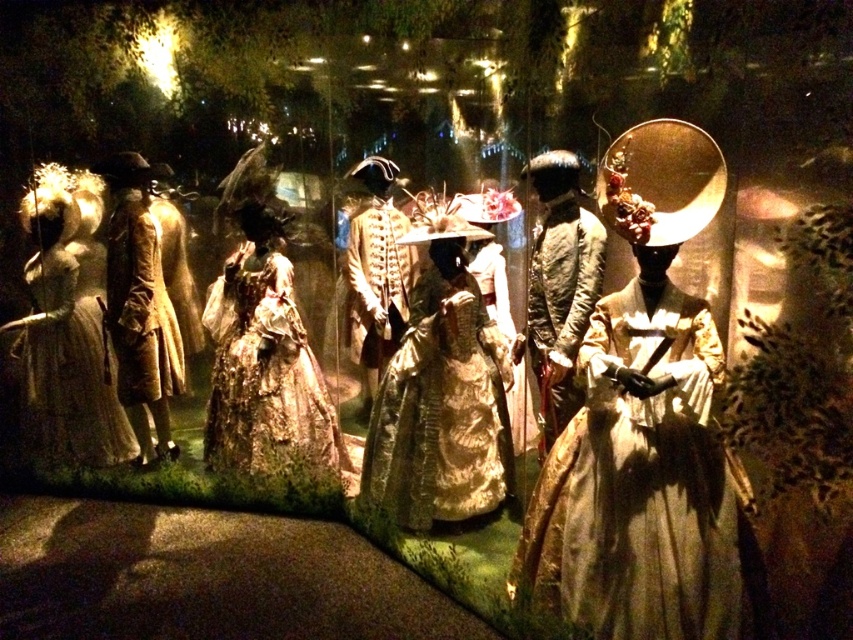
Between gold satin dress at center and gold lace gown at center, which one is positioned lower?

Positioned lower is gold satin dress at center.

Who is more distant from viewer, (x=396, y=486) or (x=285, y=355)?

The point (x=285, y=355) is behind.

Between point (459, 385) and point (235, 252), which one is positioned behind?

Positioned behind is point (235, 252).

You are a GUI agent. You are given a task and a screenshot of the screen. Output one action in this format:
    pyautogui.click(x=<x>, y=<y>)
    Task: Click on the gold satin dress at center
    The image size is (853, 640).
    Given the screenshot: What is the action you would take?
    pyautogui.click(x=440, y=396)

What do you see at coordinates (440, 396) in the screenshot? I see `gold satin dress at center` at bounding box center [440, 396].

Find the location of a particular element. The width and height of the screenshot is (853, 640). gold satin dress at center is located at coordinates (440, 396).

At what (x,y) coordinates should I click in order to perform the action: click on gold satin dress at center. Please return your answer as a coordinate pair (x, y). The height and width of the screenshot is (640, 853). Looking at the image, I should click on (440, 396).

Is shiny gold fabric coat at center thinner than light brown wool coat at left?

Indeed, shiny gold fabric coat at center has a lesser width compared to light brown wool coat at left.

Looking at this image, does shiny gold fabric coat at center appear on the right side of light brown wool coat at left?

Indeed, shiny gold fabric coat at center is positioned on the right side of light brown wool coat at left.

Identify the location of shiny gold fabric coat at center. The width and height of the screenshot is (853, 640). (561, 305).